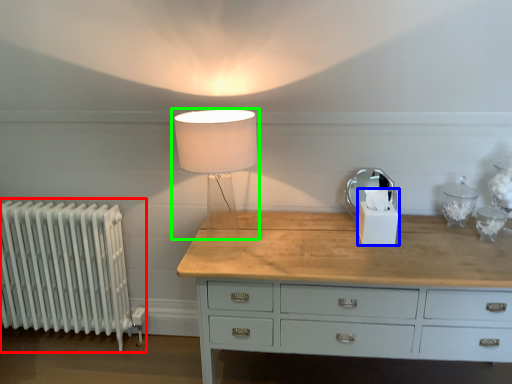
Question: Estimate the real-world distances between objects in this image. Which object is farther from radiator (highlighted by a red box), candle holder (highlighted by a blue box) or lamp (highlighted by a green box)?

Choices:
 (A) candle holder
 (B) lamp

Answer: (A)